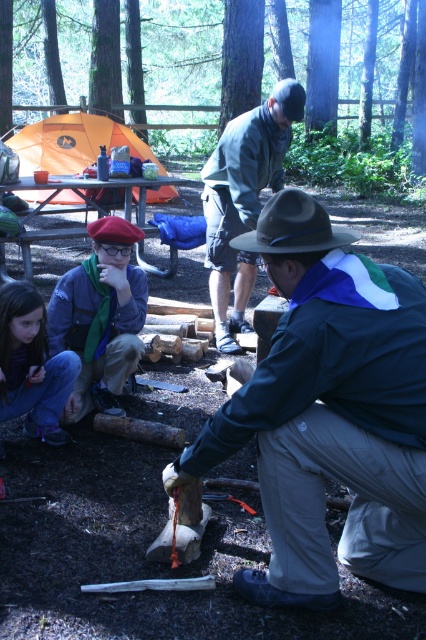
You are standing at the center of the campsite and see a point marked at coordinates (328, 412). According to the scene description, where is this point located?

The point at coordinates (328, 412) is located on the dark blue uniform at center.

Consider the image. You are organizing a camping trip and need to pack clothing items. If you have a backpack with a width capacity of 20 inches, and the dark blue uniform at center is 18 inches wide while the matte blue shirt at center is 15 inches wide, which clothing item can fit in the backpack?

The matte blue shirt at center can fit in the backpack since its width is 15 inches, which is under the 20 inches capacity. The dark blue uniform at center is 18 inches wide, which also fits, but since the question asks for which can fit, both technically fit, but the answer should highlight the one that definitely fits within the limit. Wait, maybe the question is designed to have only one correct answer. Let me check the objects description again. The description says the dark blue uniform is wider than a

You are a hiker trying to decide which clothing item to wear for better visibility in the forest. The dark blue uniform at center and the gray fabric jacket at center are both available. Based on their sizes, which one might be more suitable for visibility?

The gray fabric jacket at center is taller than the dark blue uniform at center, so it might be more suitable for visibility as it stands out more in the forest environment.